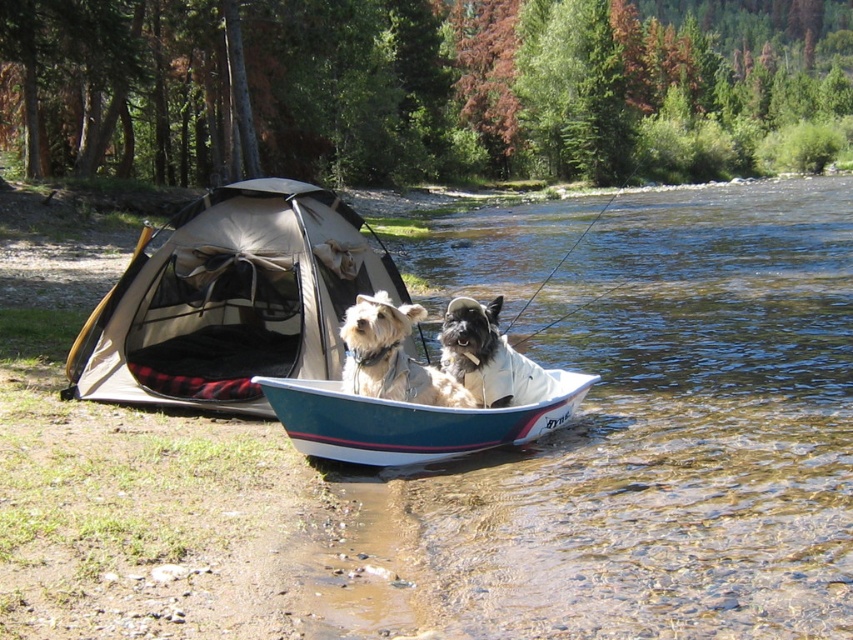
You are a photographer standing at the riverbank. You want to take a photo of the light brown fur coat at center and the white fur dog at center. If your camera has a maximum focus range of 14 inches, will both subjects be in focus?

The distance between the light brown fur coat at center and the white fur dog at center is 14.09 inches. Since the camera can only focus within 14 inches, the subjects are slightly out of the focus range. Therefore, they might not both be in focus.